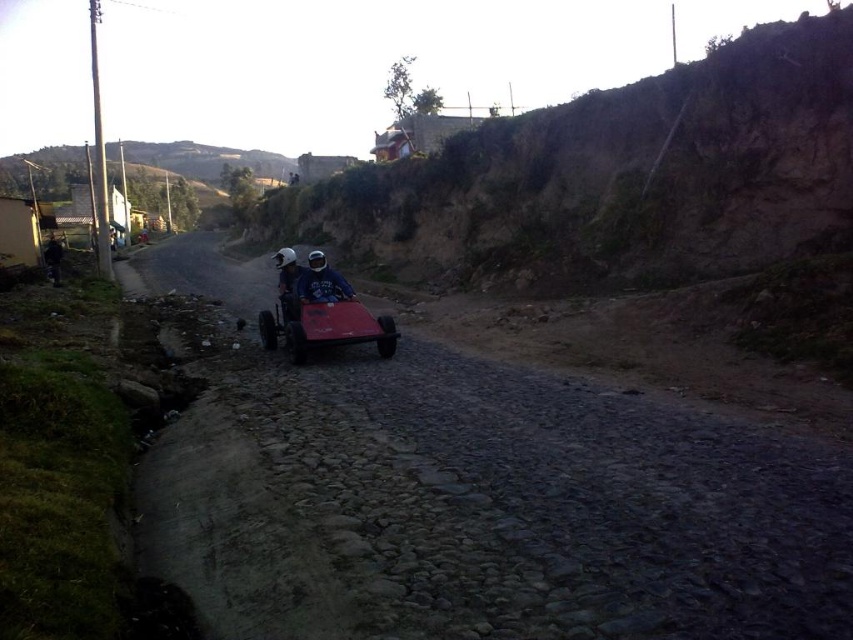
You are a delivery person trying to navigate the cobblestone road in the image. You see a shiny red toy car at center and a matte blue helmet at center. Which object is closer to the road surface?

The shiny red toy car at center is positioned under the matte blue helmet at center, so the shiny red toy car at center is closer to the road surface.

You are navigating a small vehicle along the cobblestone road in the rural scene. Your current position is at point [283,260]. You want to reach a destination at point [341,285]. Can you safely proceed forward from your current position towards the destination?

Point [341,285] is behind point [283,260], so you cannot safely proceed forward from your current position towards the destination because the destination is behind you.